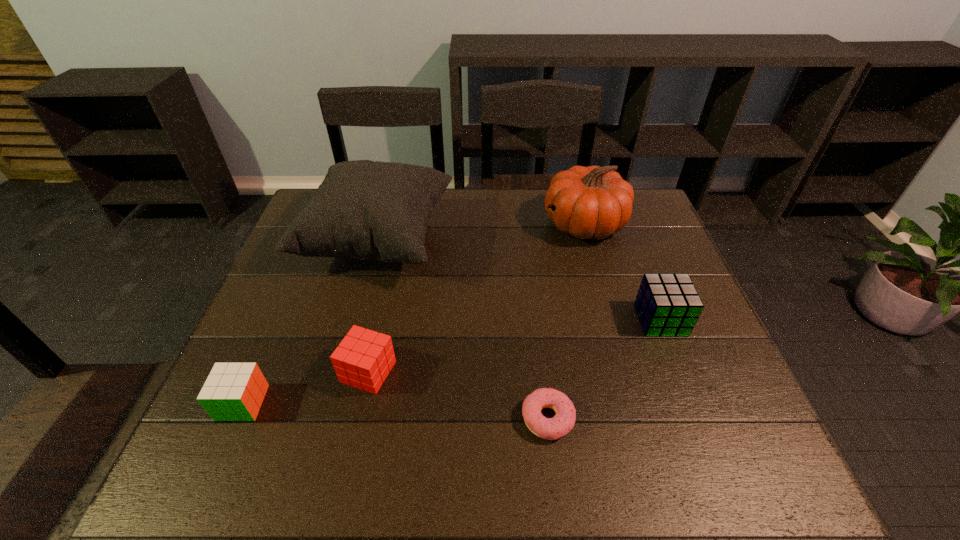
Locate an element on the screen. This screenshot has height=540, width=960. vacant region between the pumpkin and the fourth object from left to right is located at coordinates (565, 321).

At what (x,y) coordinates should I click in order to perform the action: click on object that can be found as the closest to the cushion. Please return your answer as a coordinate pair (x, y). Looking at the image, I should click on (363, 360).

Locate which object is the second closest to the leftmost cube. Please provide its 2D coordinates. Your answer should be formatted as a tuple, i.e. [(x, y)], where the tuple contains the x and y coordinates of a point satisfying the conditions above.

[(366, 210)]

Find the location of a particular element. This screenshot has height=540, width=960. cube that is the third closest one to the pumpkin is located at coordinates (233, 391).

Locate which cube is the second closest to the shortest object. Please provide its 2D coordinates. Your answer should be formatted as a tuple, i.e. [(x, y)], where the tuple contains the x and y coordinates of a point satisfying the conditions above.

[(363, 360)]

I want to click on vacant area in the image that satisfies the following two spatial constraints: 1. on the front side of the second cube from left to right; 2. on the left side of the shortest object, so click(358, 418).

I want to click on free space in the image that satisfies the following two spatial constraints: 1. on the face of the rightmost cube; 2. on the left side of the pumpkin, so click(x=611, y=320).

Where is `free space in the image that satisfies the following two spatial constraints: 1. on the front side of the fourth nearest object; 2. on the left side of the cushion`? The width and height of the screenshot is (960, 540). free space in the image that satisfies the following two spatial constraints: 1. on the front side of the fourth nearest object; 2. on the left side of the cushion is located at coordinates (357, 320).